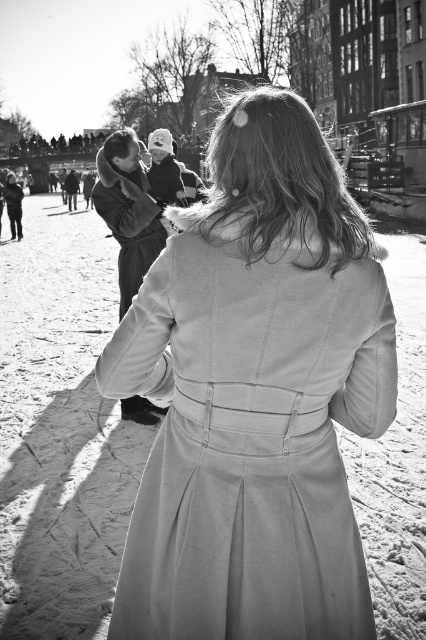
Can you confirm if satin-like white dress at center is shorter than smooth beige trench coat at center?

Yes.

Which is in front, point (207, 440) or point (97, 182)?

Point (207, 440) is more forward.

You are a GUI agent. You are given a task and a screenshot of the screen. Output one action in this format:
    pyautogui.click(x=<x>, y=<y>)
    Task: Click on the satin-like white dress at center
    
    Given the screenshot: What is the action you would take?
    pyautogui.click(x=250, y=435)